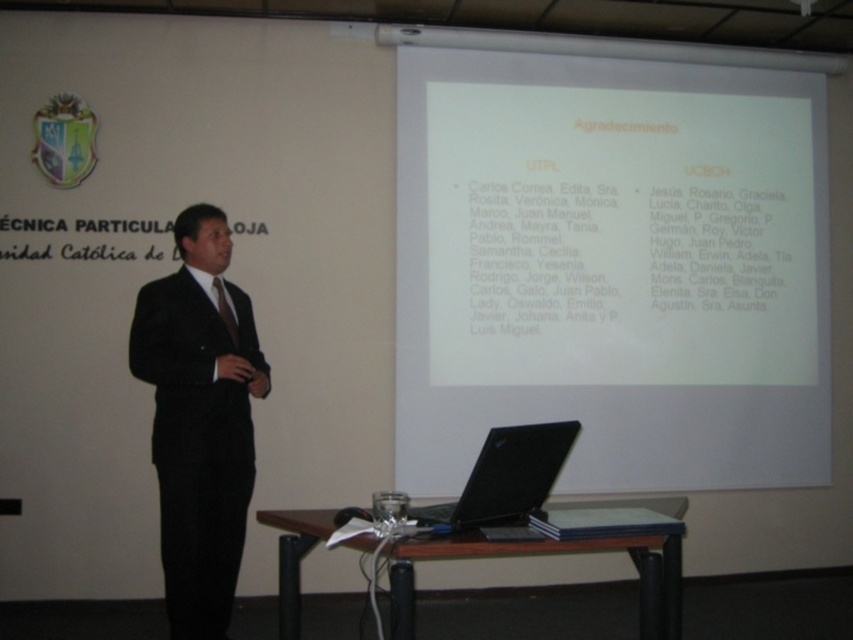
Locate an element on the screen. The height and width of the screenshot is (640, 853). white paper at upper center is located at coordinates (612, 268).

Who is positioned more to the right, white paper at upper center or black matte laptop at lower center?

white paper at upper center

Is point (747, 179) positioned behind point (538, 428)?

That is True.

You are a GUI agent. You are given a task and a screenshot of the screen. Output one action in this format:
    pyautogui.click(x=<x>, y=<y>)
    Task: Click on the white paper at upper center
    
    Given the screenshot: What is the action you would take?
    pyautogui.click(x=612, y=268)

Who is more distant from viewer, (167,513) or (537,500)?

Positioned behind is point (167,513).

Based on the photo, between black textured suit at center and black matte laptop at lower center, which one appears on the right side from the viewer's perspective?

black matte laptop at lower center is more to the right.

Locate an element on the screen. The width and height of the screenshot is (853, 640). black textured suit at center is located at coordinates (199, 420).

Which of these two, black textured suit at center or matte black tie at center, stands shorter?

matte black tie at center

Does point (239, 472) come in front of point (221, 298)?

Yes, it is.

You are a GUI agent. You are given a task and a screenshot of the screen. Output one action in this format:
    pyautogui.click(x=<x>, y=<y>)
    Task: Click on the black textured suit at center
    The image size is (853, 640).
    Given the screenshot: What is the action you would take?
    pyautogui.click(x=199, y=420)